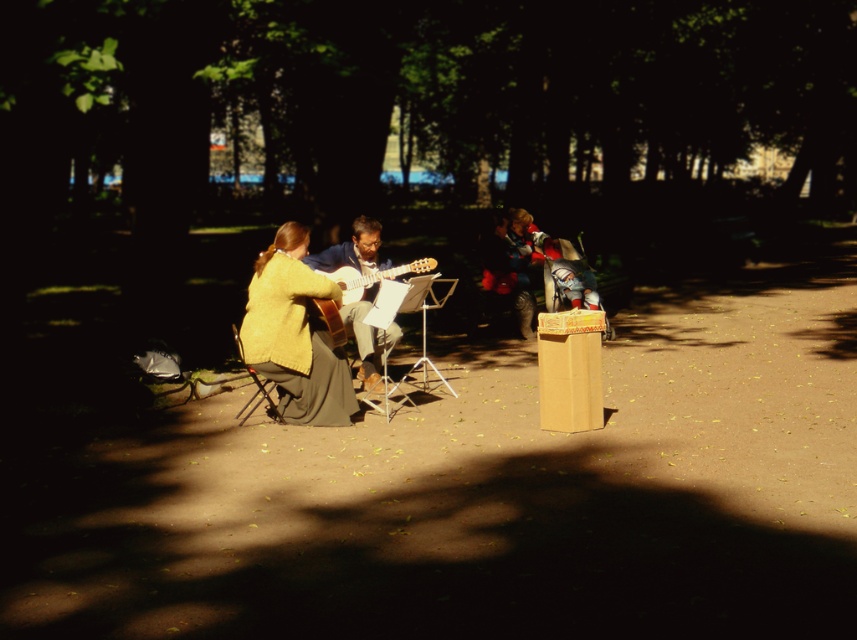
Question: Which object is positioned closest to the matte yellow sweater at center?

Choices:
 (A) matte brown guitar at center
 (B) wooden folding chair at lower left
 (C) light brown wooden guitar at center

Answer: (B)

Question: Which point is closer to the camera taking this photo?

Choices:
 (A) (271, 406)
 (B) (273, 304)
 (C) (376, 285)
 (D) (411, 262)

Answer: (B)

Question: Which point appears farthest from the camera in this image?

Choices:
 (A) (385, 260)
 (B) (240, 348)
 (C) (372, 280)

Answer: (A)

Question: Observing the image, what is the correct spatial positioning of matte yellow sweater at center in reference to light brown wooden guitar at center?

Choices:
 (A) below
 (B) above

Answer: (A)

Question: Can you confirm if matte brown guitar at center is positioned to the left of light brown wooden guitar at center?

Choices:
 (A) yes
 (B) no

Answer: (A)

Question: Observing the image, what is the correct spatial positioning of matte brown guitar at center in reference to wooden folding chair at lower left?

Choices:
 (A) left
 (B) right

Answer: (B)